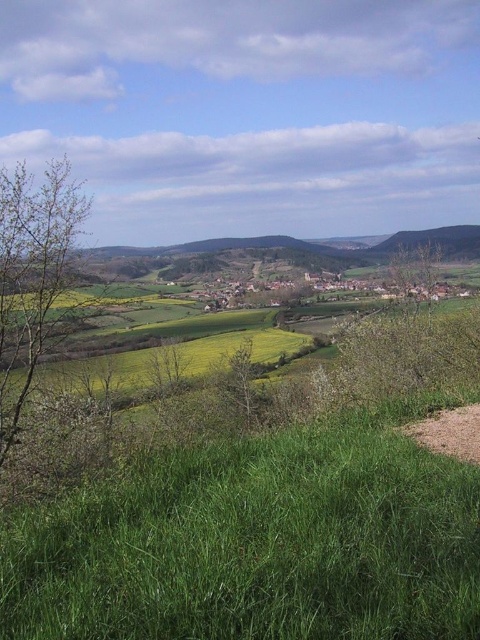
Which is more to the right, green grassy at lower right or brown dirt trail at lower right?

brown dirt trail at lower right

Which is behind, point (41, 556) or point (441, 419)?

The point (441, 419) is more distant.

Identify the location of green grassy at lower right. This screenshot has width=480, height=640. (254, 545).